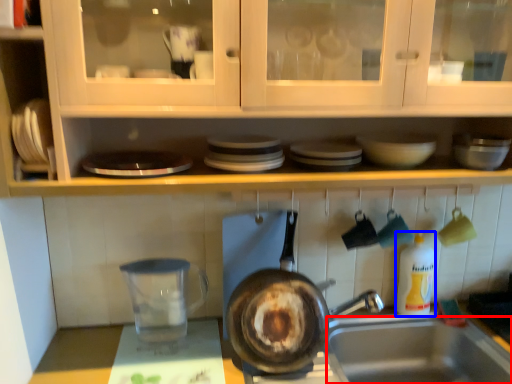
Question: Which object appears farthest to the camera in this image, sink (highlighted by a red box) or bottle (highlighted by a blue box)?

Choices:
 (A) sink
 (B) bottle

Answer: (B)